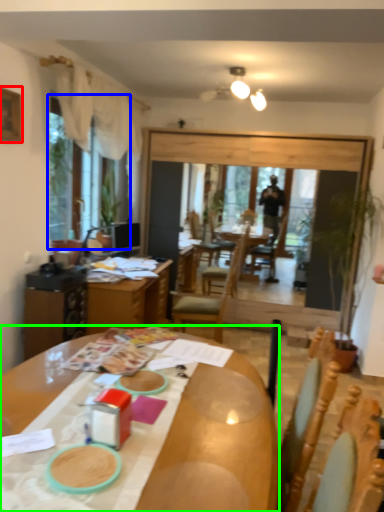
Question: Considering the real-world distances, which object is closest to picture frame (highlighted by a red box)? window screen (highlighted by a blue box) or desk (highlighted by a green box).

Choices:
 (A) window screen
 (B) desk

Answer: (A)